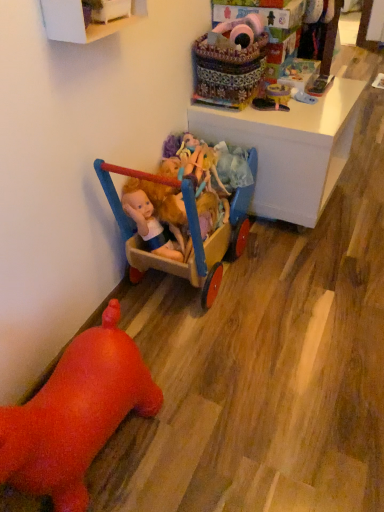
Question: From the image's perspective, is white painted wood cabinet at upper left located beneath black rubber shoe at upper right, acting as the third toy starting from the top?

Choices:
 (A) no
 (B) yes

Answer: (A)

Question: Does white painted wood cabinet at upper left have a lesser height compared to black rubber shoe at upper right, acting as the third toy starting from the top?

Choices:
 (A) yes
 (B) no

Answer: (B)

Question: Considering the relative positions of white painted wood cabinet at upper left and black rubber shoe at upper right, which is the 4th toy from bottom to top, in the image provided, is white painted wood cabinet at upper left in front of black rubber shoe at upper right, which is the 4th toy from bottom to top,?

Choices:
 (A) no
 (B) yes

Answer: (B)

Question: From a real-world perspective, is white painted wood cabinet at upper left positioned over black rubber shoe at upper right, acting as the third toy starting from the top, based on gravity?

Choices:
 (A) no
 (B) yes

Answer: (B)

Question: Is white painted wood cabinet at upper left surrounding black rubber shoe at upper right, which is the 4th toy from bottom to top?

Choices:
 (A) yes
 (B) no

Answer: (B)

Question: Can you confirm if white painted wood cabinet at upper left is smaller than black rubber shoe at upper right, acting as the third toy starting from the top?

Choices:
 (A) yes
 (B) no

Answer: (B)

Question: Can you confirm if fluffy pink plush at upper center, acting as the 1th toy starting from the top, is thinner than wooden cart at center, which is counted as the 5th toy, starting from the top?

Choices:
 (A) yes
 (B) no

Answer: (A)

Question: Is fluffy pink plush at upper center, acting as the 1th toy starting from the top, wider than wooden cart at center, which is counted as the 5th toy, starting from the top?

Choices:
 (A) no
 (B) yes

Answer: (A)

Question: From a real-world perspective, is fluffy pink plush at upper center, acting as the 1th toy starting from the top, physically above wooden cart at center, the 2th toy positioned from the bottom?

Choices:
 (A) yes
 (B) no

Answer: (A)

Question: From the image's perspective, is fluffy pink plush at upper center, acting as the 1th toy starting from the top, on top of wooden cart at center, which is counted as the 5th toy, starting from the top?

Choices:
 (A) yes
 (B) no

Answer: (A)

Question: Is fluffy pink plush at upper center, acting as the 1th toy starting from the top, to the left of wooden cart at center, the 2th toy positioned from the bottom, from the viewer's perspective?

Choices:
 (A) no
 (B) yes

Answer: (A)

Question: Is fluffy pink plush at upper center, which appears as the sixth toy when ordered from the bottom, not inside wooden cart at center, which is counted as the 5th toy, starting from the top?

Choices:
 (A) no
 (B) yes

Answer: (B)

Question: From the image's perspective, does matte plastic toy at upper center, which appears as the second toy when viewed from the top, appear lower than white glossy desk at upper center?

Choices:
 (A) yes
 (B) no

Answer: (B)